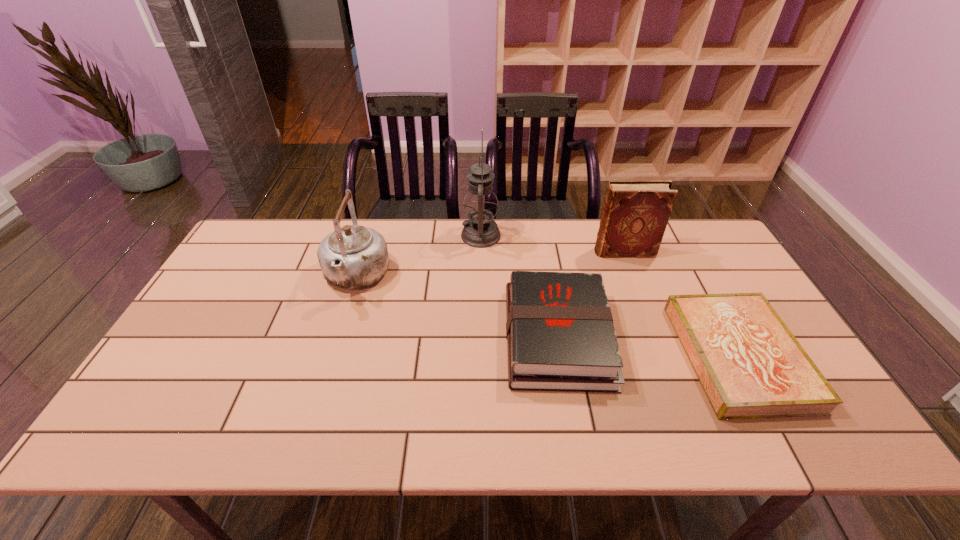
Find the location of a particular element. the tallest object is located at coordinates (480, 204).

The image size is (960, 540). I want to click on kettle, so click(x=352, y=257).

Identify the location of the tallest hardback book. This screenshot has width=960, height=540. (635, 214).

Identify the location of the leftmost hardback book. (560, 335).

Locate an element on the screen. Image resolution: width=960 pixels, height=540 pixels. the fourth tallest object is located at coordinates 560,335.

The image size is (960, 540). I want to click on the shortest hardback book, so click(750, 365).

The height and width of the screenshot is (540, 960). Find the location of `vacant region located 0.080m on the front of the tallest object`. vacant region located 0.080m on the front of the tallest object is located at coordinates (481, 266).

This screenshot has height=540, width=960. Identify the location of vacant region located 0.360m at the spout of the kettle. (310, 422).

Identify the location of vacant position located 0.160m on the spine side of the tallest hardback book. (545, 252).

Find the location of a particular element. Image resolution: width=960 pixels, height=540 pixels. vacant space situated 0.210m on the spine side of the tallest hardback book is located at coordinates (529, 252).